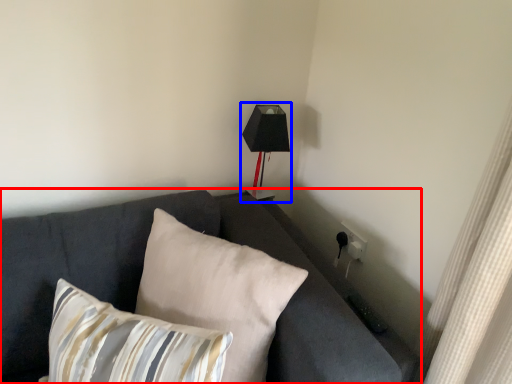
Question: Among these objects, which one is nearest to the camera, studio couch (highlighted by a red box) or table lamp (highlighted by a blue box)?

Choices:
 (A) studio couch
 (B) table lamp

Answer: (A)